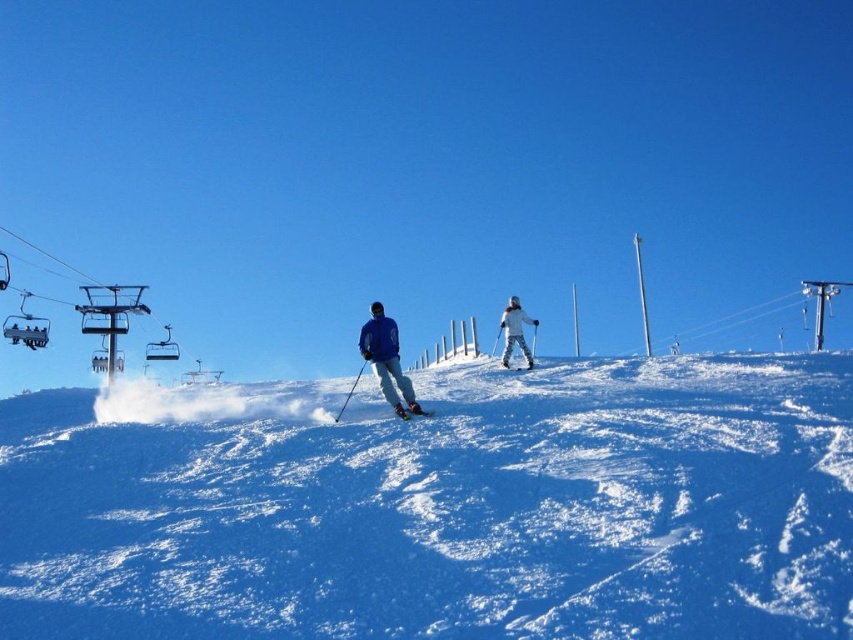
You are a photographer positioned at the top of the slope and want to capture both the white snowsuit at center and the matte blue ski at center in your photo. Which object will appear larger in your photo?

The white snowsuit at center will appear larger in the photo because it is closer to the photographer than the matte blue ski at center.

You are a skier planning to descend the slope shown in the image. You notice the white powdery snow at center and the blue matte jacket at center. Which object is lower in height?

The white powdery snow at center is shorter than the blue matte jacket at center, so the white powdery snow at center is lower in height.